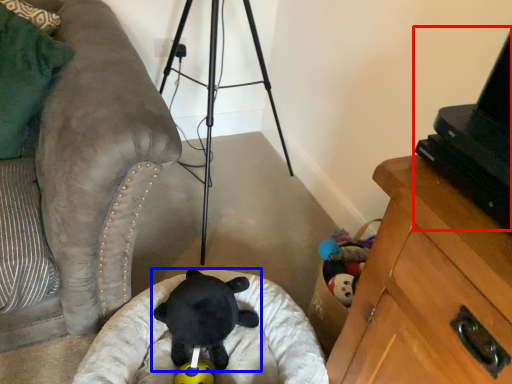
Question: Which object is further to the camera taking this photo, computer (highlighted by a red box) or toy (highlighted by a blue box)?

Choices:
 (A) computer
 (B) toy

Answer: (B)